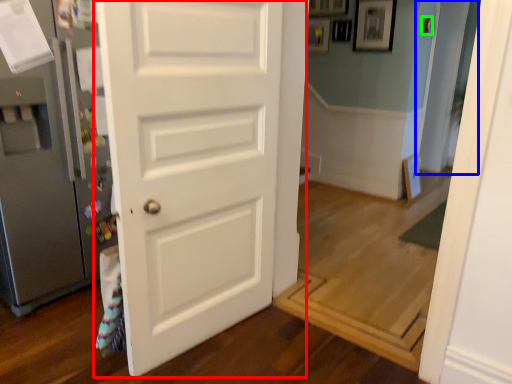
Question: Which is nearer to the door (highlighted by a red box)? glass door (highlighted by a blue box) or door handle (highlighted by a green box).

Choices:
 (A) glass door
 (B) door handle

Answer: (B)